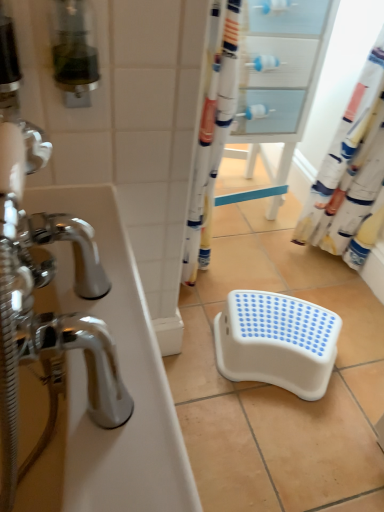
This screenshot has width=384, height=512. Identify the location of free area in between white fabric shower curtain at right and white plastic step stool at center. (317, 290).